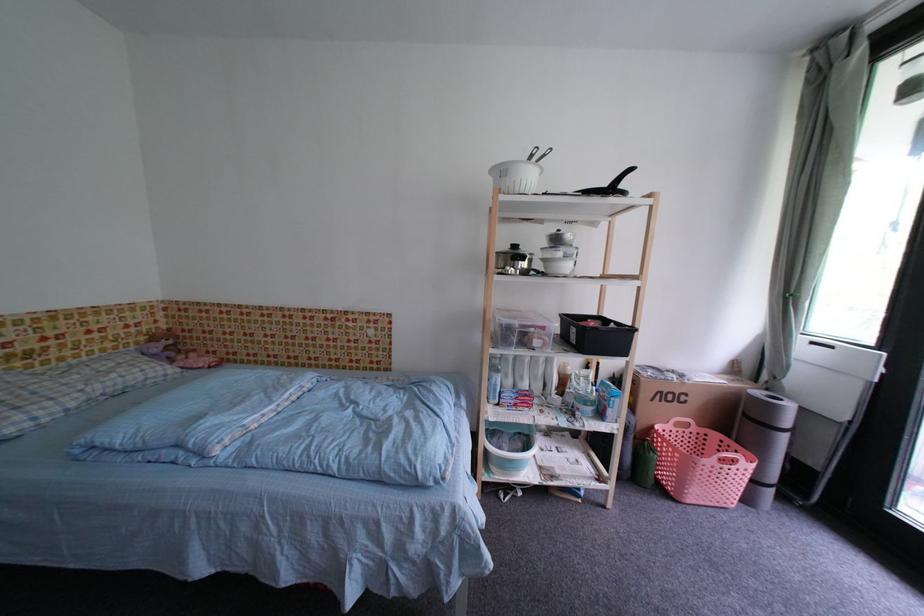
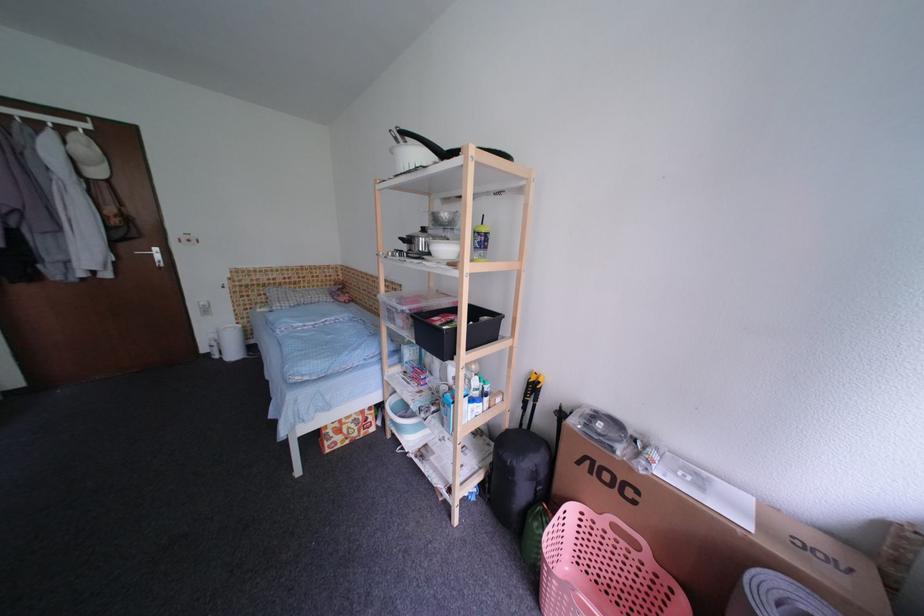
The point at (688, 432) is marked in the first image. Where is the corresponding point in the second image?

(630, 546)